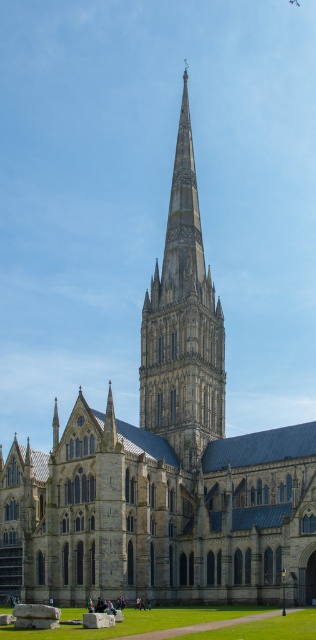
The width and height of the screenshot is (316, 640). What do you see at coordinates (182, 323) in the screenshot? I see `gray stone spire at center` at bounding box center [182, 323].

This screenshot has height=640, width=316. Identify the location of gray stone spire at center. (182, 323).

Identify the location of gray stone spire at center. The width and height of the screenshot is (316, 640). (182, 323).